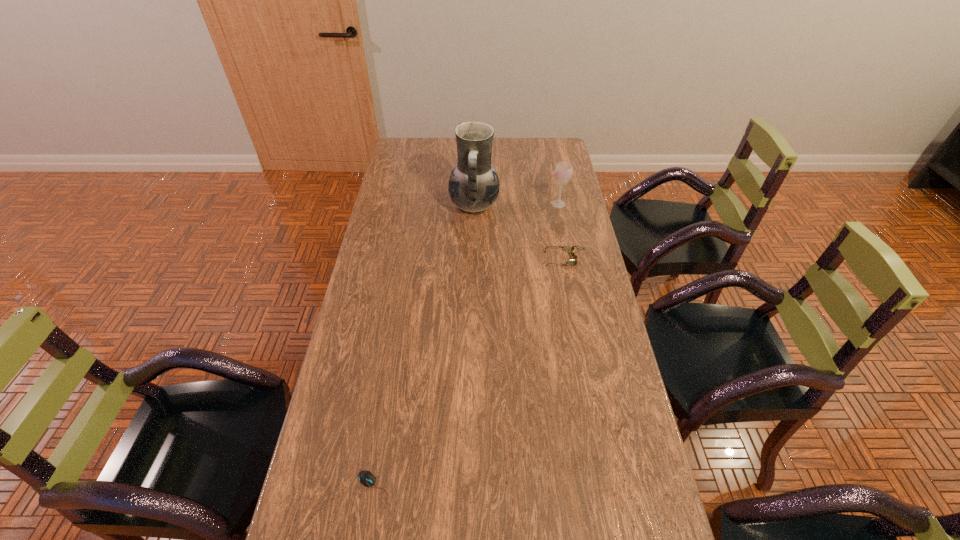
The width and height of the screenshot is (960, 540). I want to click on vacant space located on the front-facing side of the third farthest object, so click(x=481, y=259).

At what (x,y) coordinates should I click in order to perform the action: click on vacant space located 0.110m on the front-facing side of the third farthest object. Please return your answer as a coordinate pair (x, y). The height and width of the screenshot is (540, 960). Looking at the image, I should click on click(515, 259).

Locate an element on the screen. Image resolution: width=960 pixels, height=540 pixels. vacant area situated on the back of the nearest object is located at coordinates (388, 403).

I want to click on object located in the left edge section of the desktop, so click(366, 478).

This screenshot has height=540, width=960. I want to click on wineglass positioned at the right edge, so click(x=563, y=171).

You are a GUI agent. You are given a task and a screenshot of the screen. Output one action in this format:
    pyautogui.click(x=<x>, y=<y>)
    Task: Click on the spectacles located at the right edge
    This screenshot has height=540, width=960.
    Given the screenshot: What is the action you would take?
    pyautogui.click(x=567, y=249)

This screenshot has height=540, width=960. Find the location of `free space at the far edge`. free space at the far edge is located at coordinates (453, 156).

Image resolution: width=960 pixels, height=540 pixels. I want to click on vacant area at the left edge, so click(x=383, y=246).

The width and height of the screenshot is (960, 540). I want to click on free space at the right edge of the desktop, so click(633, 454).

At what (x,y) coordinates should I click in order to perform the action: click on free space at the far right corner. Please return your answer as a coordinate pair (x, y). The width and height of the screenshot is (960, 540). Looking at the image, I should click on (552, 145).